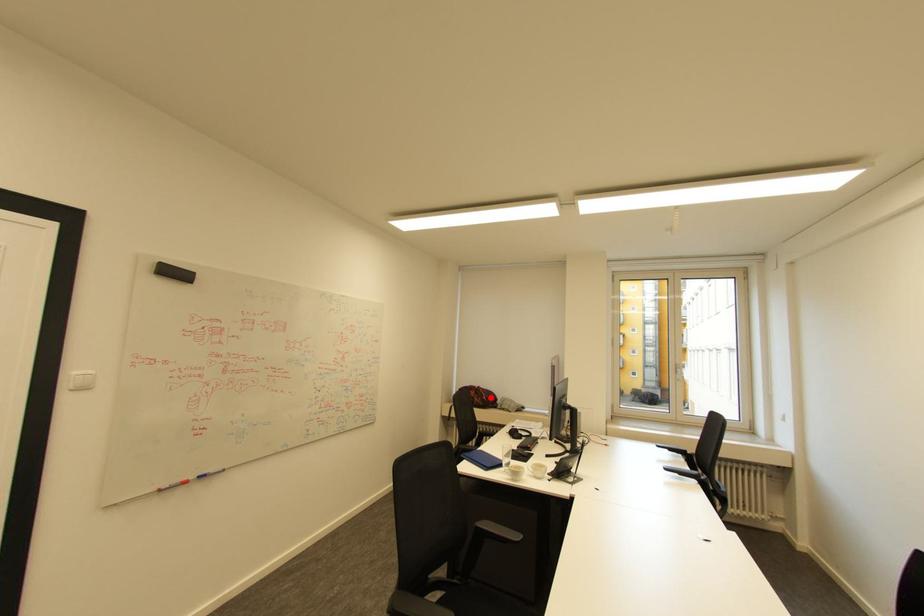
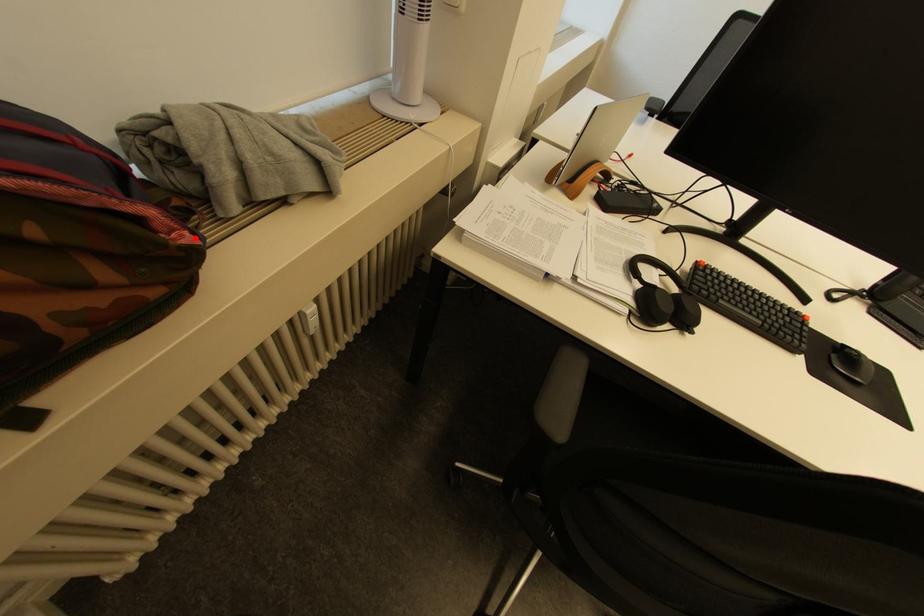
I am providing you with two images of the same scene from different viewpoints. A red point is marked on the first image and another point is marked on the second image. Does the point marked in image1 correspond to the same location as the one in image2?

Yes